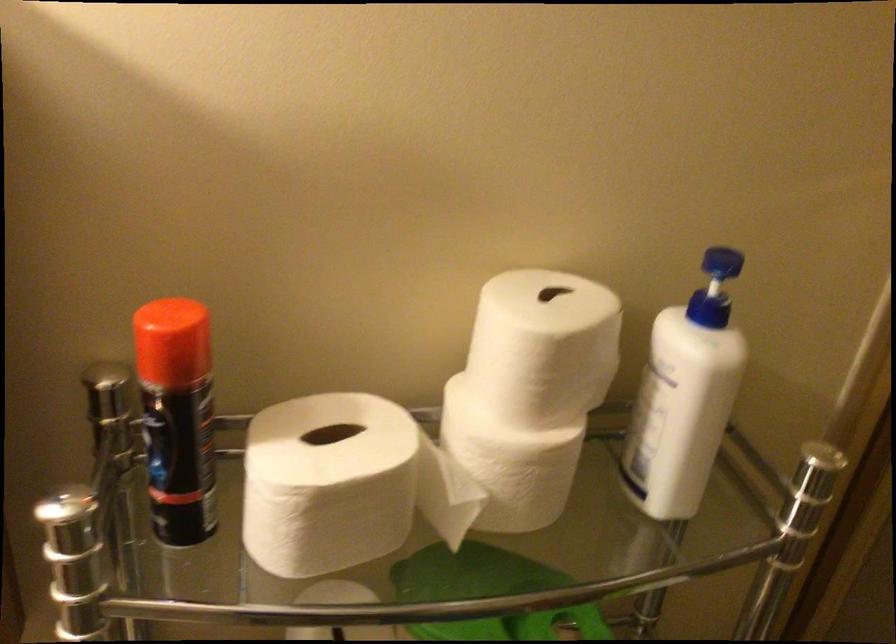
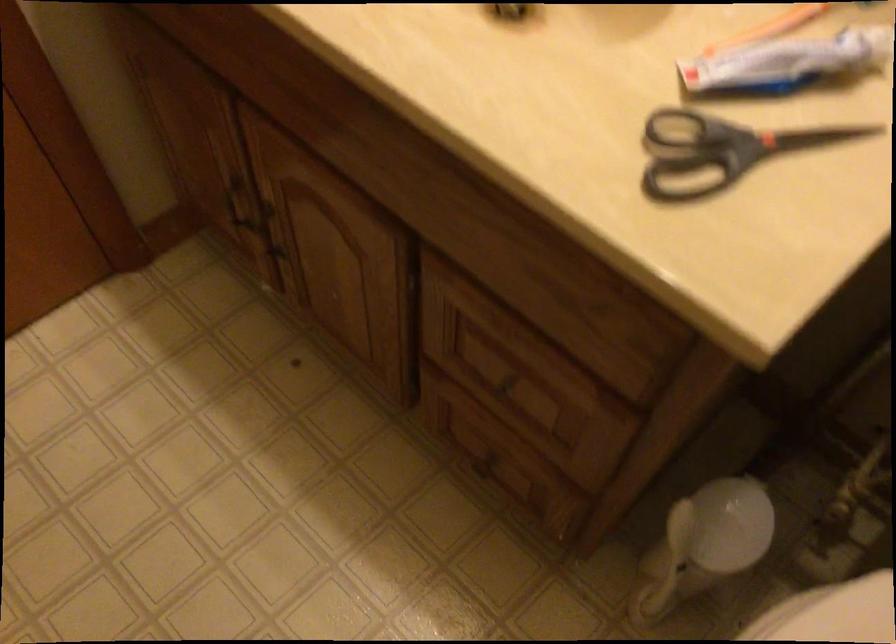
The first image is from the beginning of the video and the second image is from the end. How did the camera likely rotate when shooting the video?

The rotation direction of the camera is left-down.